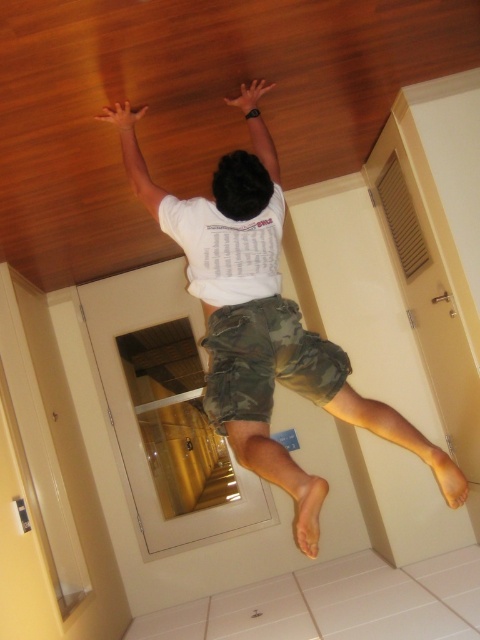
Can you confirm if white matte t-shirt at upper center is taller than matte white arm at upper center?

Yes, white matte t-shirt at upper center is taller than matte white arm at upper center.

Can you confirm if white matte t-shirt at upper center is positioned to the left of matte white arm at upper center?

Indeed, white matte t-shirt at upper center is positioned on the left side of matte white arm at upper center.

Where is `white matte t-shirt at upper center`? This screenshot has width=480, height=640. white matte t-shirt at upper center is located at coordinates (263, 328).

Locate an element on the screen. Image resolution: width=480 pixels, height=640 pixels. white matte t-shirt at upper center is located at coordinates (263, 328).

Does white matte arm at upper center come behind matte white arm at upper center?

No, white matte arm at upper center is closer to the viewer.

Can you confirm if white matte arm at upper center is positioned above matte white arm at upper center?

No, white matte arm at upper center is not above matte white arm at upper center.

Find the location of a particular element. The image size is (480, 640). white matte arm at upper center is located at coordinates (133, 154).

Between camo fabric shorts at lower center and matte white arm at upper center, which one appears on the left side from the viewer's perspective?

matte white arm at upper center

Who is taller, camo fabric shorts at lower center or matte white arm at upper center?

matte white arm at upper center

Is point (256, 308) positioned in front of point (242, 90)?

Yes, point (256, 308) is in front of point (242, 90).

At what (x,y) coordinates should I click in order to perform the action: click on camo fabric shorts at lower center. Please return your answer as a coordinate pair (x, y). Looking at the image, I should click on point(265,360).